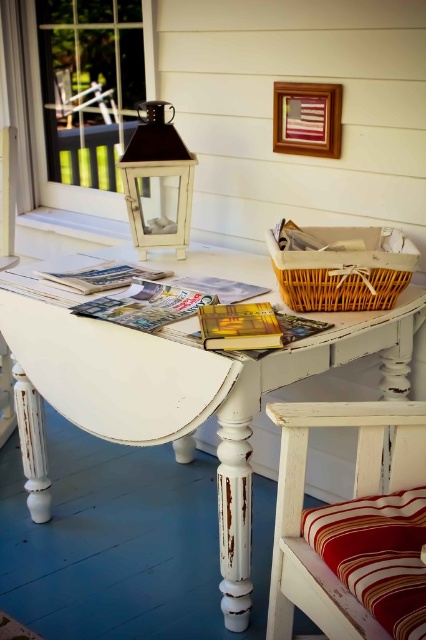
Question: Which object is the farthest from the matte paper magazine at center?

Choices:
 (A) white distressed wood table at center
 (B) striped fabric cushion at lower right
 (C) matte glass lantern at upper center
 (D) printed paper magazine at center

Answer: (B)

Question: Is striped fabric cushion at lower right closer to camera compared to matte glass lantern at upper center?

Choices:
 (A) no
 (B) yes

Answer: (B)

Question: Which point is closer to the camera taking this photo?

Choices:
 (A) (362, 600)
 (B) (409, 406)
 (C) (141, 102)

Answer: (A)

Question: Can you confirm if printed paper magazine at center is wider than matte paper magazine at center?

Choices:
 (A) yes
 (B) no

Answer: (B)

Question: Does distressed white wooden chair with striped cushion at lower right appear over matte paper magazine at center?

Choices:
 (A) yes
 (B) no

Answer: (B)

Question: Estimate the real-world distances between objects in this image. Which object is closer to the printed paper magazine at center?

Choices:
 (A) matte glass lantern at upper center
 (B) white distressed wood table at center

Answer: (B)